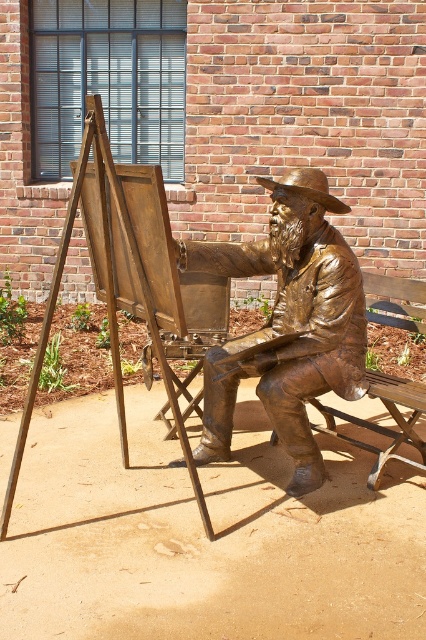
Question: Which point is farther to the camera?

Choices:
 (A) (284, 179)
 (B) (285, 348)

Answer: (A)

Question: Which of the following is the farthest from the observer?

Choices:
 (A) (36, 369)
 (B) (207, 244)

Answer: (B)

Question: Does bronze statue at center appear under bronze textured cowboy hat at center?

Choices:
 (A) yes
 (B) no

Answer: (A)

Question: Can you confirm if bronze statue at center is positioned above bronze textured cowboy hat at center?

Choices:
 (A) yes
 (B) no

Answer: (B)

Question: Is wooden easel at left to the right of bronze textured cowboy hat at center from the viewer's perspective?

Choices:
 (A) yes
 (B) no

Answer: (B)

Question: Considering the real-world distances, which object is farthest from the bronze statue at center?

Choices:
 (A) bronze textured cowboy hat at center
 (B) wooden easel at left

Answer: (A)